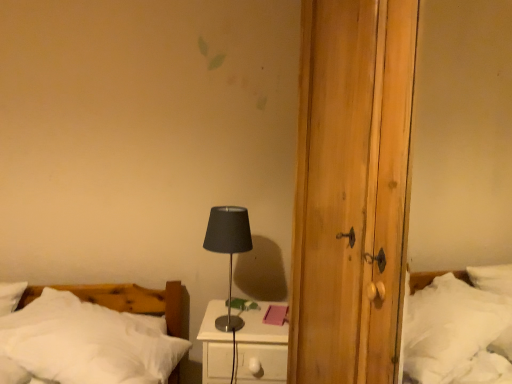
The width and height of the screenshot is (512, 384). Find the location of `vacant region below black metallic table lamp at center (from a real-world perspective)`. vacant region below black metallic table lamp at center (from a real-world perspective) is located at coordinates (220, 329).